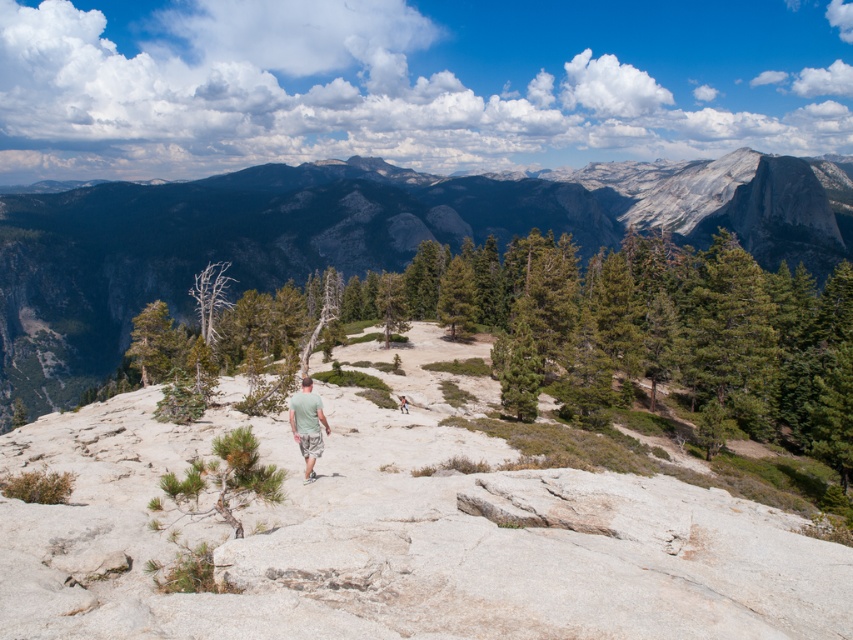
Question: In this image, where is gray rock formation at center located relative to green fabric shirt at center?

Choices:
 (A) right
 (B) left

Answer: (A)

Question: Which point is farther from the camera taking this photo?

Choices:
 (A) (405, 408)
 (B) (587, 234)
 (C) (314, 458)
 (D) (410, 410)

Answer: (B)

Question: Can you confirm if green cotton shirt at center is positioned to the left of green fabric shirt at center?

Choices:
 (A) no
 (B) yes

Answer: (B)

Question: Is gray rock at center bigger than gray rock formation at center?

Choices:
 (A) no
 (B) yes

Answer: (A)

Question: Which point is farther from the camera taking this photo?

Choices:
 (A) (293, 422)
 (B) (401, 401)

Answer: (B)

Question: Which of the following is the farthest from the observer?

Choices:
 (A) gray rock at center
 (B) green fabric shirt at center
 (C) green cotton shirt at center
 (D) gray rock formation at center

Answer: (D)